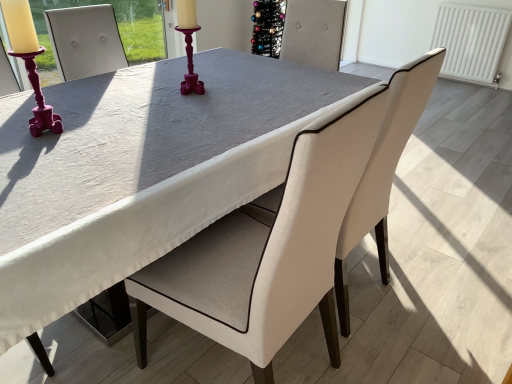
Question: Does white fabric chair at center, the first chair viewed from the right, appear on the right side of white fabric chair at center, which is the 2th chair from right to left?

Choices:
 (A) yes
 (B) no

Answer: (A)

Question: Is white fabric chair at center, the 2th chair positioned from the left, at the left side of white fabric chair at center, which is the 2th chair from right to left?

Choices:
 (A) yes
 (B) no

Answer: (B)

Question: From the image's perspective, does white fabric chair at center, the 2th chair positioned from the left, appear lower than white fabric chair at center, positioned as the first chair in left-to-right order?

Choices:
 (A) yes
 (B) no

Answer: (B)

Question: Is white fabric chair at center, the 2th chair positioned from the left, positioned with its back to white fabric chair at center, which is the 2th chair from right to left?

Choices:
 (A) no
 (B) yes

Answer: (A)

Question: From a real-world perspective, is white fabric chair at center, the 2th chair positioned from the left, on white fabric chair at center, positioned as the first chair in left-to-right order?

Choices:
 (A) yes
 (B) no

Answer: (B)

Question: From the image's perspective, is white fabric chair at center, the first chair viewed from the right, located above or below white fabric chair at center, which is the 2th chair from right to left?

Choices:
 (A) below
 (B) above

Answer: (B)

Question: Is point (352, 231) positioned closer to the camera than point (212, 236)?

Choices:
 (A) farther
 (B) closer

Answer: (A)

Question: Is white fabric chair at center, the 2th chair positioned from the left, in front of or behind white fabric chair at center, which is the 2th chair from right to left, in the image?

Choices:
 (A) front
 (B) behind

Answer: (B)

Question: From a real-world perspective, relative to white fabric chair at center, positioned as the first chair in left-to-right order, is white fabric chair at center, the 2th chair positioned from the left, vertically above or below?

Choices:
 (A) above
 (B) below

Answer: (B)

Question: Is matte pink candlestick at left taller or shorter than white fabric chair at center, positioned as the first chair in left-to-right order?

Choices:
 (A) tall
 (B) short

Answer: (B)

Question: Looking at their shapes, would you say matte pink candlestick at left is wider or thinner than white fabric chair at center, positioned as the first chair in left-to-right order?

Choices:
 (A) thin
 (B) wide

Answer: (A)

Question: Would you say matte pink candlestick at left is to the left or to the right of white fabric chair at center, which is the 2th chair from right to left, in the picture?

Choices:
 (A) left
 (B) right

Answer: (A)

Question: From the image's perspective, is matte pink candlestick at left located above or below white fabric chair at center, which is the 2th chair from right to left?

Choices:
 (A) below
 (B) above

Answer: (B)

Question: In terms of width, does white fabric chair at center, positioned as the first chair in left-to-right order, look wider or thinner when compared to matte pink candlestick at left?

Choices:
 (A) thin
 (B) wide

Answer: (B)

Question: Is white fabric chair at center, positioned as the first chair in left-to-right order, bigger or smaller than matte pink candlestick at left?

Choices:
 (A) small
 (B) big

Answer: (B)